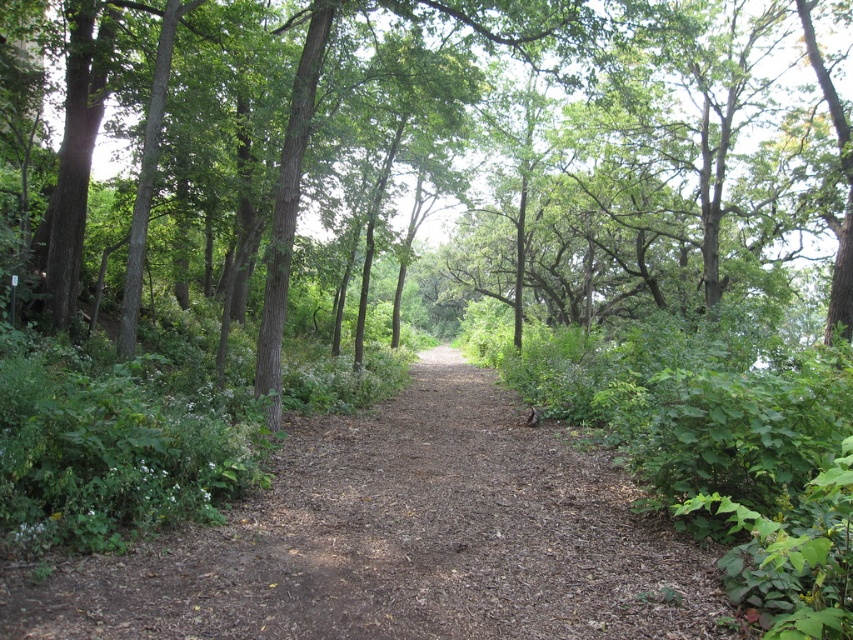
Question: Which of the following is the farthest from the observer?

Choices:
 (A) (436, 26)
 (B) (621, 595)

Answer: (A)

Question: Which point is closer to the camera taking this photo?

Choices:
 (A) (686, 122)
 (B) (461, 387)

Answer: (B)

Question: In this image, where is brown rough tree at center located relative to brown dirt trail at center?

Choices:
 (A) right
 (B) left

Answer: (A)

Question: Observing the image, what is the correct spatial positioning of brown rough tree at center in reference to brown dirt trail at center?

Choices:
 (A) right
 (B) left

Answer: (A)

Question: Can you confirm if brown rough tree at center is positioned above brown dirt trail at center?

Choices:
 (A) yes
 (B) no

Answer: (A)